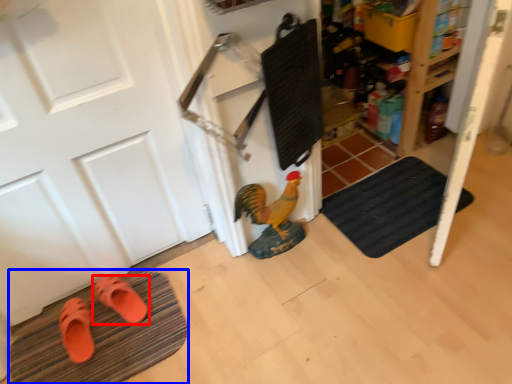
Question: Which of the following is the farthest to the observer, footwear (highlighted by a red box) or bath mat (highlighted by a blue box)?

Choices:
 (A) footwear
 (B) bath mat

Answer: (A)